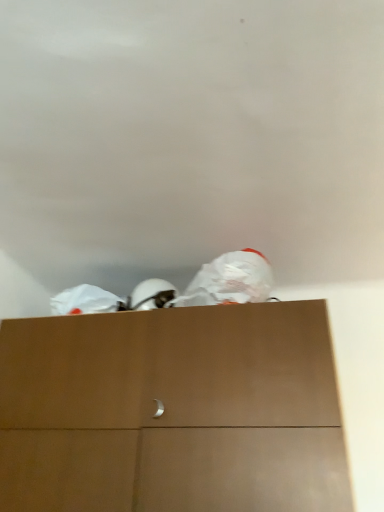
In order to face white matte plastic bag at upper center, should I rotate leftwards or rightwards?

Rotate your view right by about 3.986°.

The height and width of the screenshot is (512, 384). I want to click on white matte plastic bag at upper center, so click(x=230, y=281).

Describe the element at coordinates (230, 281) in the screenshot. The image size is (384, 512). I see `white matte plastic bag at upper center` at that location.

At what (x,y) coordinates should I click in order to perform the action: click on white matte plastic bag at upper center. Please return your answer as a coordinate pair (x, y). Image resolution: width=384 pixels, height=512 pixels. Looking at the image, I should click on (230, 281).